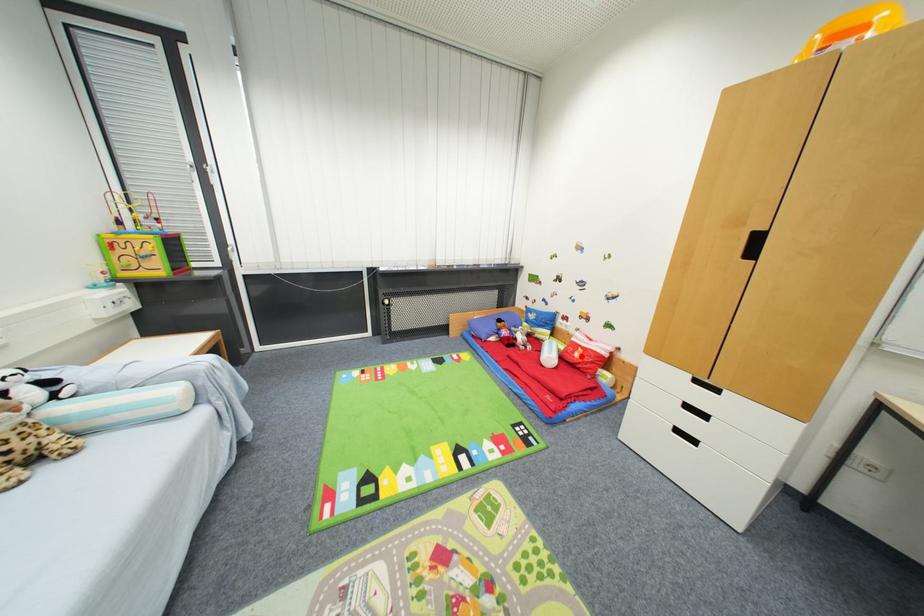
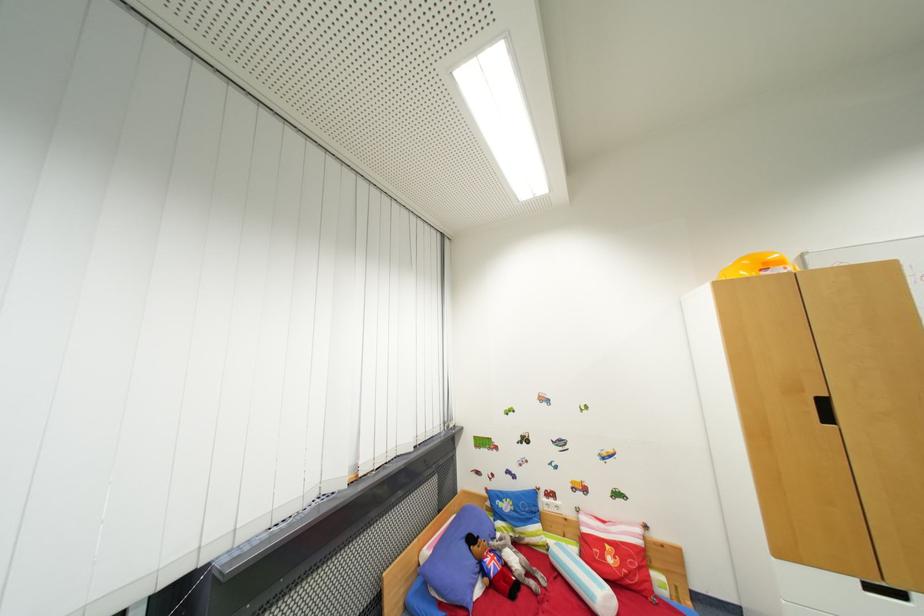
Question: A red point is marked in image1. In image2, is the corresponding 3D point closer to the camera or farther? Reply with the corresponding letter.

Choices:
 (A) The corresponding 3D point is closer.
 (B) The corresponding 3D point is farther.

Answer: (B)